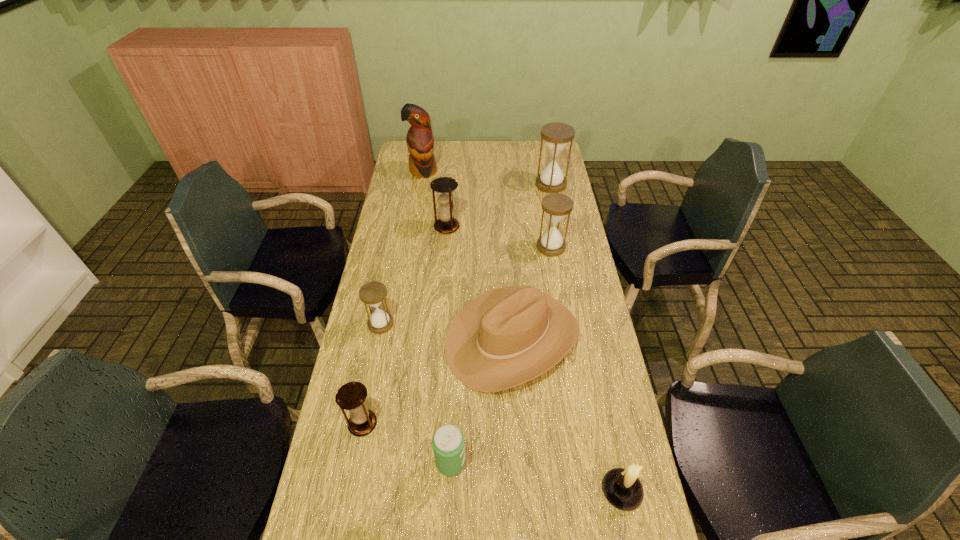
Select which hourglass is the fourth closest to the third farthest object. Please provide its 2D coordinates. Your answer should be formatted as a tuple, i.e. [(x, y)], where the tuple contains the x and y coordinates of a point satisfying the conditions above.

[(351, 396)]

The width and height of the screenshot is (960, 540). In order to click on the second closest hourglass to the parrot in this screenshot , I will do click(x=556, y=135).

Find the location of `white hourglass that stands as the closest to the farthest hourglass`. white hourglass that stands as the closest to the farthest hourglass is located at coordinates (556, 206).

You are a GUI agent. You are given a task and a screenshot of the screen. Output one action in this format:
    pyautogui.click(x=<x>, y=<y>)
    Task: Click on the white hourglass that is the second closest to the smallest white hourglass
    
    Given the screenshot: What is the action you would take?
    pyautogui.click(x=556, y=135)

Locate an element on the screen. Image resolution: width=960 pixels, height=540 pixels. free spot that satisfies the following two spatial constraints: 1. on the face of the tallest object; 2. on the right side of the tallest hourglass is located at coordinates (421, 184).

Where is `free space that satisfies the following two spatial constraints: 1. on the face of the third hourglass from left to right; 2. on the left side of the red parrot`? free space that satisfies the following two spatial constraints: 1. on the face of the third hourglass from left to right; 2. on the left side of the red parrot is located at coordinates (414, 227).

At what (x,y) coordinates should I click in order to perform the action: click on vacant space that satisfies the following two spatial constraints: 1. on the back side of the second biggest white hourglass; 2. on the right side of the cowboy hat. Please return your answer as a coordinate pair (x, y). Looking at the image, I should click on (507, 247).